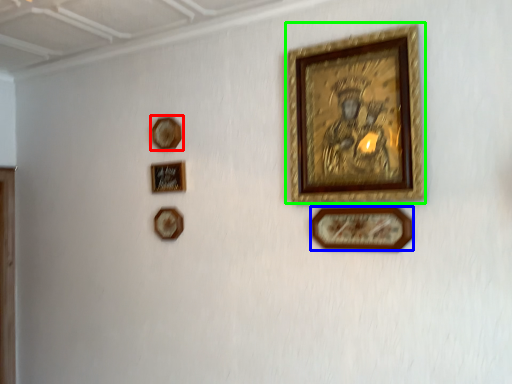
Question: Which object is the farthest from picture frame (highlighted by a red box)? Choose among these: picture frame (highlighted by a blue box) or picture frame (highlighted by a green box).

Choices:
 (A) picture frame
 (B) picture frame

Answer: (A)